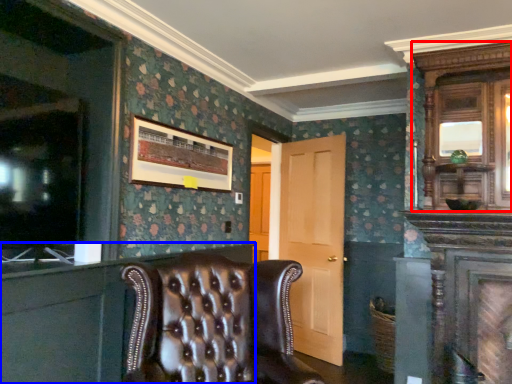
Question: Which object is further to the camera taking this photo, armoire (highlighted by a red box) or dresser (highlighted by a blue box)?

Choices:
 (A) armoire
 (B) dresser

Answer: (A)